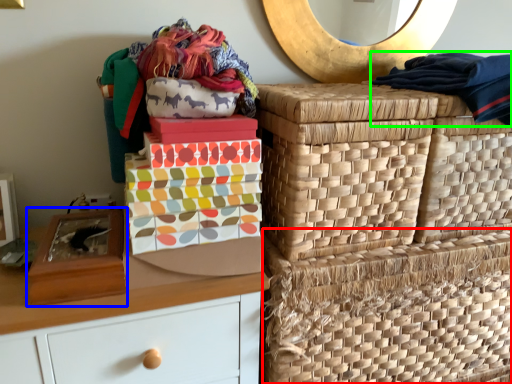
Question: Estimate the real-world distances between objects in this image. Which object is farther from basket (highlighted by a red box), shoe box (highlighted by a blue box) or clothing (highlighted by a green box)?

Choices:
 (A) shoe box
 (B) clothing

Answer: (A)